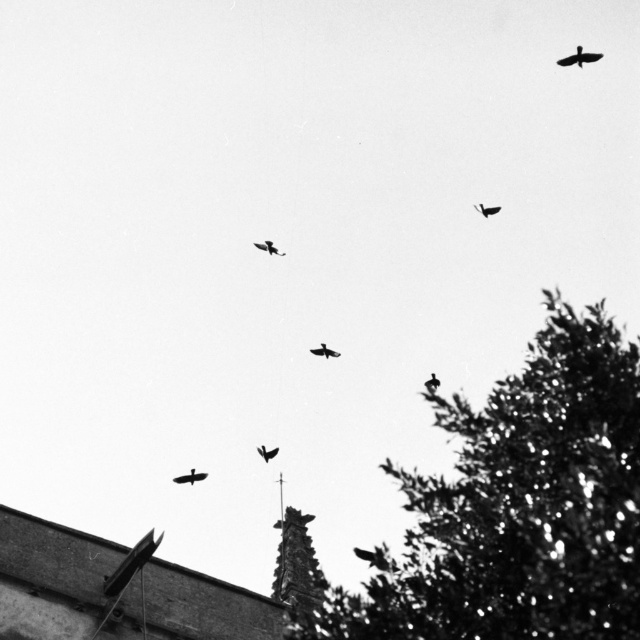
Question: Is silhouette glossy bird at center positioned behind silhouette feathered bird at center?

Choices:
 (A) yes
 (B) no

Answer: (B)

Question: Does smooth black bird at center have a smaller size compared to smooth black bird at upper right?

Choices:
 (A) no
 (B) yes

Answer: (B)

Question: Which object is positioned farthest from the smooth black bird at upper right?

Choices:
 (A) silhouette feathered bird at center
 (B) black matte bird at upper right

Answer: (B)

Question: Which point is farther from the camera taking this photo?

Choices:
 (A) (337, 353)
 (B) (513, 458)

Answer: (A)

Question: Can you confirm if silhouette feathered bird at lower right is wider than silhouette glossy bird at center?

Choices:
 (A) no
 (B) yes

Answer: (B)

Question: Considering the real-world distances, which object is farthest from the smooth black bird at upper right?

Choices:
 (A) smooth black bird at center
 (B) black matte bird at center
 (C) green leafy tree at lower right

Answer: (C)